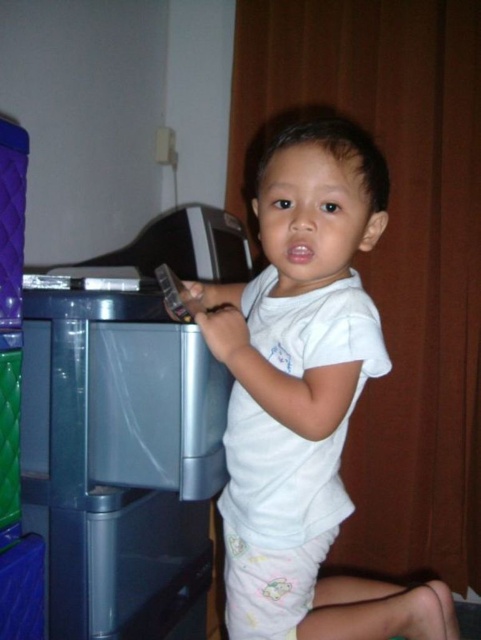
Does white cotton shirt at center have a greater height compared to transparent plastic atm at left?

Indeed, white cotton shirt at center has a greater height compared to transparent plastic atm at left.

Who is more forward, (368, 220) or (137, 408)?

Point (368, 220)

This screenshot has height=640, width=481. Find the location of `white cotton shirt at center`. white cotton shirt at center is located at coordinates (298, 339).